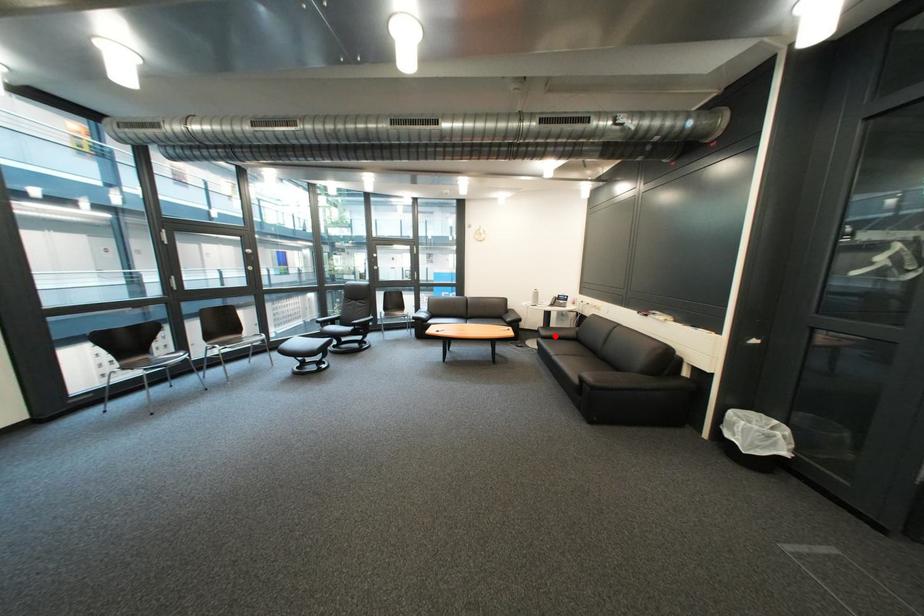
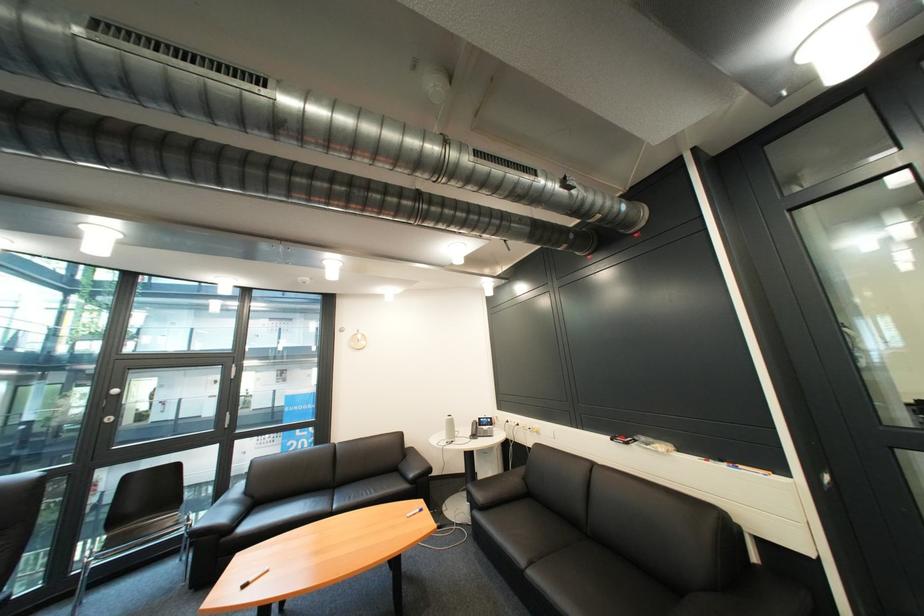
In the second image, find the point that corresponds to the highlighted location in the first image.

(491, 504)